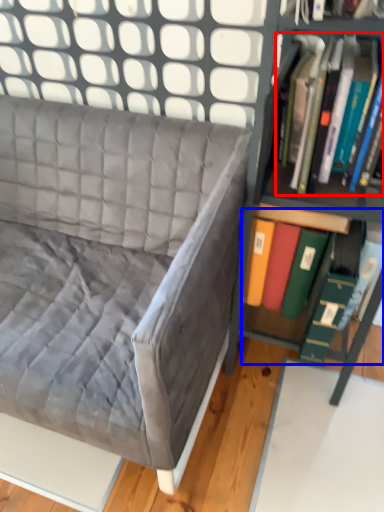
Question: Which of the following is the farthest to the observer, book (highlighted by a red box) or book (highlighted by a blue box)?

Choices:
 (A) book
 (B) book

Answer: (B)